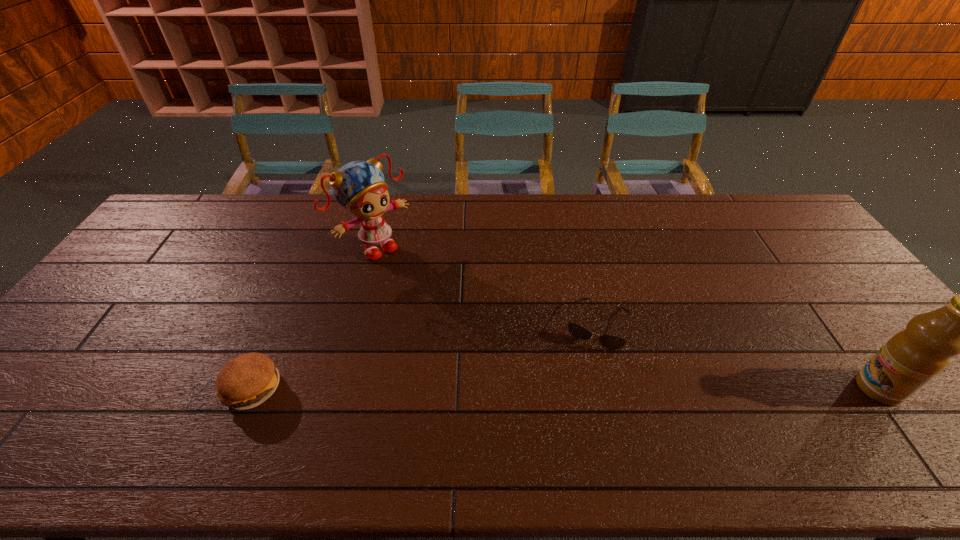
At what (x,y) coordinates should I click in order to perform the action: click on object that is at the right edge. Please return your answer as a coordinate pair (x, y). Looking at the image, I should click on (911, 358).

What are the coordinates of `object located in the near right corner section of the desktop` in the screenshot? It's located at (911, 358).

Find the location of a particular element. vacant area at the far edge of the desktop is located at coordinates (395, 219).

In the image, there is a desktop. Find the location of `vacant space at the near edge`. vacant space at the near edge is located at coordinates (698, 417).

You are a GUI agent. You are given a task and a screenshot of the screen. Output one action in this format:
    pyautogui.click(x=<x>, y=<y>)
    Task: Click on the blank space at the right edge
    The height and width of the screenshot is (540, 960).
    Given the screenshot: What is the action you would take?
    pyautogui.click(x=803, y=242)

Identify the location of free space between the third tallest object and the olive oil. (565, 388).

The width and height of the screenshot is (960, 540). Find the location of `free space that is in between the doll and the hamburger`. free space that is in between the doll and the hamburger is located at coordinates (314, 318).

The image size is (960, 540). Find the location of `free space that is in between the rightmost object and the sunglasses`. free space that is in between the rightmost object and the sunglasses is located at coordinates (737, 356).

At what (x,y) coordinates should I click in order to perform the action: click on vacant area that lies between the rightmost object and the second farthest object. Please return your answer as a coordinate pair (x, y). The height and width of the screenshot is (540, 960). Looking at the image, I should click on (737, 356).

At what (x,y) coordinates should I click in order to perform the action: click on unoccupied position between the hamburger and the sunglasses. Please return your answer as a coordinate pair (x, y). Looking at the image, I should click on click(x=424, y=356).